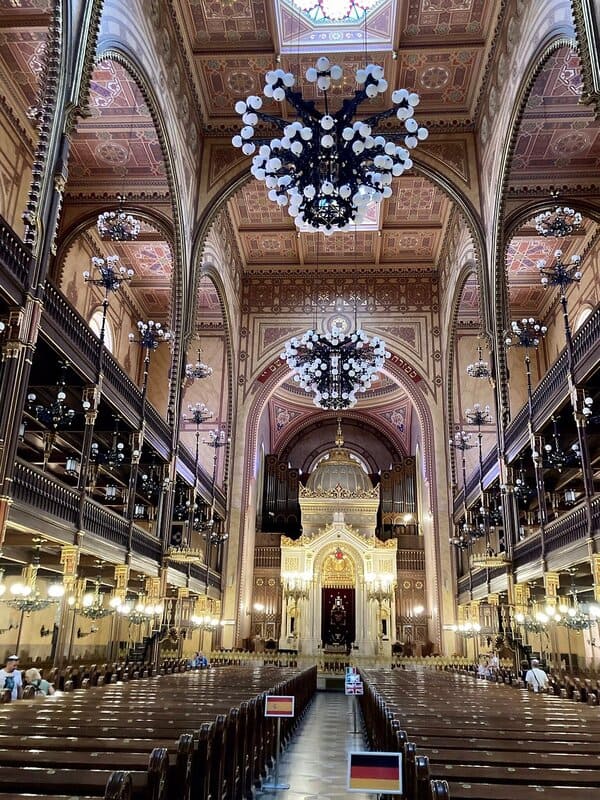
Image resolution: width=600 pixels, height=800 pixels. I want to click on space to walk between pews, so click(x=331, y=714).